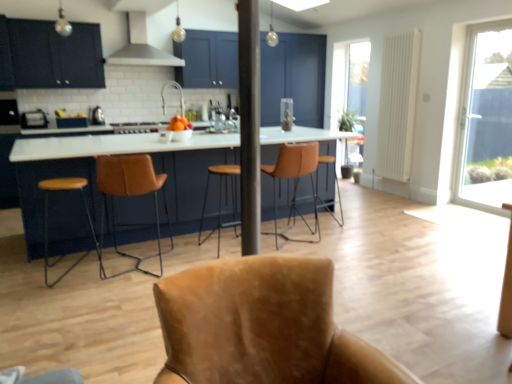
At what (x,y) coordinates should I click in order to perform the action: click on vacant region below leather at left, the 2th chair when ordered from front to back (from a real-world perspective). Please return your answer as a coordinate pair (x, y). Image resolution: width=512 pixels, height=384 pixels. Looking at the image, I should click on (143, 263).